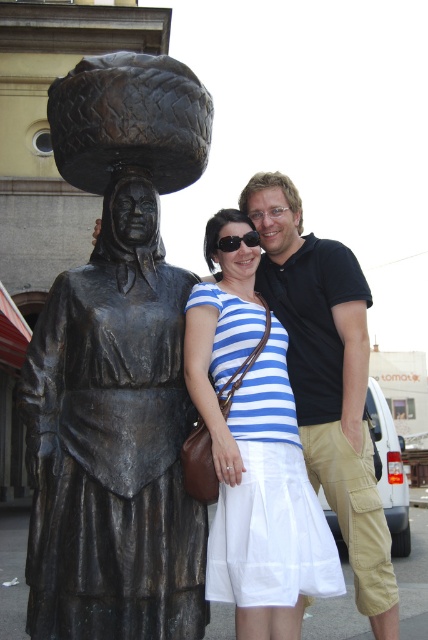
Is blue striped dress at center thinner than black cotton polo shirt at upper right?

Correct, blue striped dress at center's width is less than black cotton polo shirt at upper right's.

Describe the element at coordinates (253, 452) in the screenshot. I see `blue striped dress at center` at that location.

The image size is (428, 640). I want to click on blue striped dress at center, so click(253, 452).

At what (x,y) coordinates should I click in order to perform the action: click on bronze statue at left. Please return your answer as a coordinate pair (x, y). The height and width of the screenshot is (640, 428). Looking at the image, I should click on (116, 369).

Where is `bronze statue at left`? This screenshot has width=428, height=640. bronze statue at left is located at coordinates (116, 369).

Can you confirm if bronze statue at left is wider than black plastic sunglasses at center?

Indeed, bronze statue at left has a greater width compared to black plastic sunglasses at center.

In the scene shown: Is bronze statue at left taller than black plastic sunglasses at center?

Yes.

Is point (205, 118) farther from viewer compared to point (222, 248)?

No, it is in front of (222, 248).

You are a GUI agent. You are given a task and a screenshot of the screen. Output one action in this format:
    pyautogui.click(x=<x>, y=<y>)
    Task: Click on the bronze statue at left
    The image size is (428, 640).
    Given the screenshot: What is the action you would take?
    pyautogui.click(x=116, y=369)